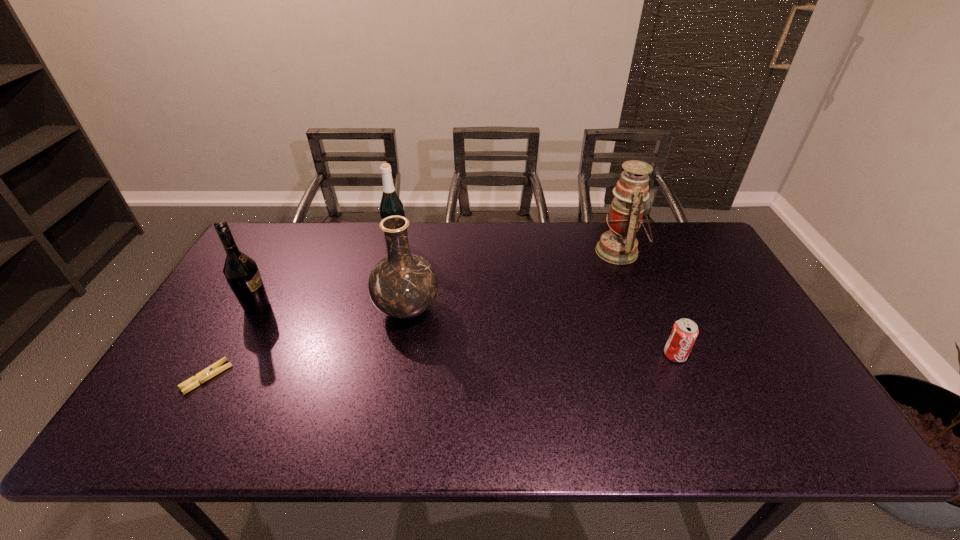
Where is `vacant space located 0.170m on the front of the second shortest object`? vacant space located 0.170m on the front of the second shortest object is located at coordinates (705, 425).

Identify the location of vacant space located on the back of the clothespin. (271, 264).

This screenshot has height=540, width=960. Identify the location of oil lamp that is positioned at the far edge. (619, 245).

You are a GUI agent. You are given a task and a screenshot of the screen. Output one action in this format:
    pyautogui.click(x=<x>, y=<y>)
    Task: Click on the wine bottle situated at the far edge
    The width and height of the screenshot is (960, 540).
    Given the screenshot: What is the action you would take?
    pyautogui.click(x=390, y=205)

The image size is (960, 540). I want to click on wine bottle at the left edge, so click(241, 272).

Find the location of a particular element. The height and width of the screenshot is (540, 960). clothespin at the left edge is located at coordinates (214, 369).

This screenshot has width=960, height=540. Find the location of `free space at the far edge`. free space at the far edge is located at coordinates (506, 224).

Find the location of a particular element. vacant space at the near edge of the desktop is located at coordinates (543, 414).

Image resolution: width=960 pixels, height=540 pixels. Identify the location of blank area at the left edge. (236, 318).

Locate an element on the screen. The image size is (960, 540). vacant space at the right edge of the desktop is located at coordinates (732, 372).